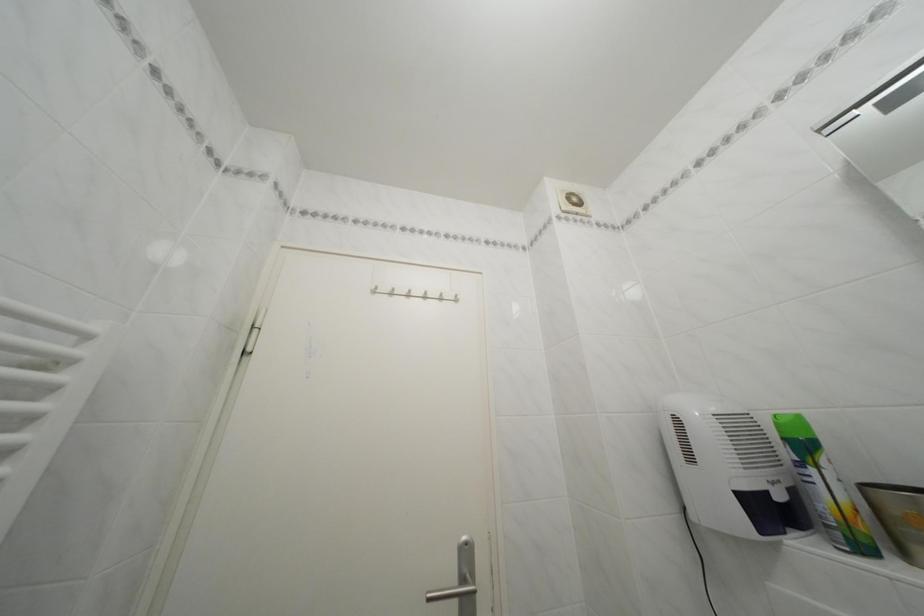
Locate an element on the screen. Image resolution: width=924 pixels, height=616 pixels. silver door handle is located at coordinates 456,592.